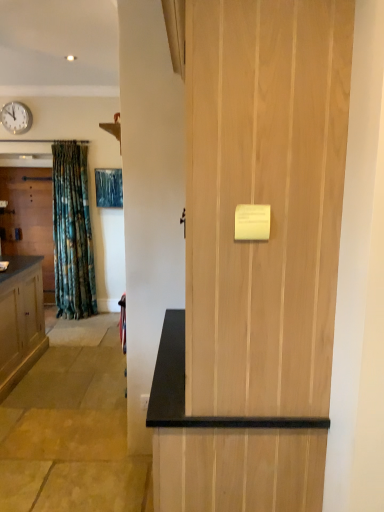
Question: In which direction should I rotate to look at natural wood door at center, the first door when ordered from right to left?

Choices:
 (A) right
 (B) left

Answer: (A)

Question: Considering the relative sizes of white plastic clock at upper left and natural wood door at center, the first door positioned from the front, in the image provided, is white plastic clock at upper left bigger than natural wood door at center, the first door positioned from the front,?

Choices:
 (A) no
 (B) yes

Answer: (A)

Question: Is the surface of white plastic clock at upper left in direct contact with natural wood door at center, the second door when ordered from left to right?

Choices:
 (A) yes
 (B) no

Answer: (B)

Question: Considering the relative sizes of white plastic clock at upper left and natural wood door at center, the second door positioned from the back, in the image provided, is white plastic clock at upper left thinner than natural wood door at center, the second door positioned from the back,?

Choices:
 (A) no
 (B) yes

Answer: (B)

Question: From a real-world perspective, is white plastic clock at upper left located beneath natural wood door at center, the second door when ordered from left to right?

Choices:
 (A) no
 (B) yes

Answer: (A)

Question: Is white plastic clock at upper left further to camera compared to natural wood door at center, the second door when ordered from left to right?

Choices:
 (A) no
 (B) yes

Answer: (B)

Question: Considering the relative sizes of white plastic clock at upper left and natural wood door at center, the first door when ordered from right to left, in the image provided, is white plastic clock at upper left shorter than natural wood door at center, the first door when ordered from right to left,?

Choices:
 (A) yes
 (B) no

Answer: (A)

Question: Is natural wood door at center, the first door positioned from the front, outside matte wood door at left, which ranks as the 1th door in back-to-front order?

Choices:
 (A) no
 (B) yes

Answer: (B)

Question: Can you confirm if natural wood door at center, the first door when ordered from right to left, is wider than matte wood door at left, arranged as the 2th door when viewed from the right?

Choices:
 (A) no
 (B) yes

Answer: (B)

Question: Does natural wood door at center, the first door positioned from the front, turn towards matte wood door at left, which ranks as the first door in left-to-right order?

Choices:
 (A) no
 (B) yes

Answer: (A)

Question: Is matte wood door at left, which ranks as the 1th door in back-to-front order, inside natural wood door at center, the first door when ordered from right to left?

Choices:
 (A) yes
 (B) no

Answer: (B)

Question: Does natural wood door at center, the second door when ordered from left to right, have a lesser height compared to matte wood door at left, arranged as the 2th door when viewed from the right?

Choices:
 (A) yes
 (B) no

Answer: (B)

Question: From the image's perspective, would you say white plastic clock at upper left is positioned over matte wood door at left, which ranks as the 1th door in back-to-front order?

Choices:
 (A) yes
 (B) no

Answer: (A)